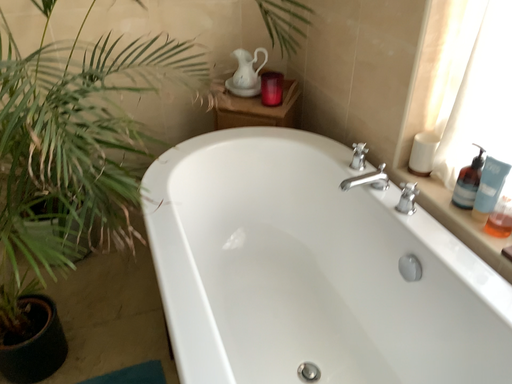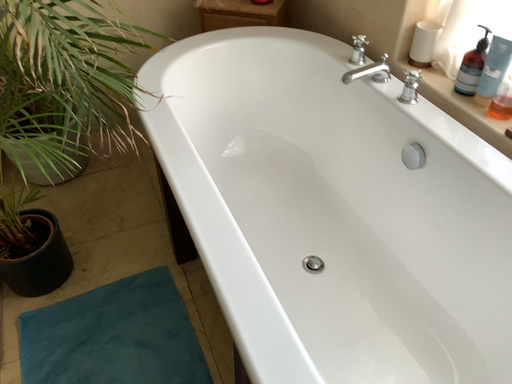
Question: Which way did the camera rotate in the video?

Choices:
 (A) rotated downward
 (B) rotated upward

Answer: (A)